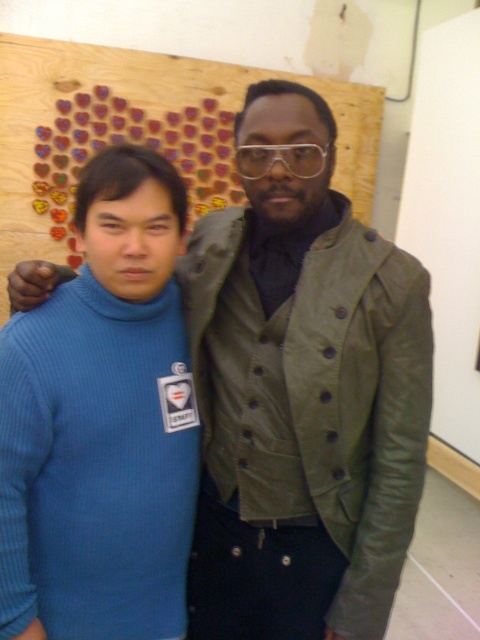
Is matte green leather vest at center below blue ribbed sweater at left?

No, matte green leather vest at center is not below blue ribbed sweater at left.

Between matte green leather vest at center and blue ribbed sweater at left, which one appears on the left side from the viewer's perspective?

Positioned to the left is blue ribbed sweater at left.

Describe the element at coordinates (303, 413) in the screenshot. Image resolution: width=480 pixels, height=640 pixels. I see `matte green leather vest at center` at that location.

You are a GUI agent. You are given a task and a screenshot of the screen. Output one action in this format:
    pyautogui.click(x=<x>, y=<y>)
    Task: Click on the matte green leather vest at center
    
    Given the screenshot: What is the action you would take?
    pyautogui.click(x=303, y=413)